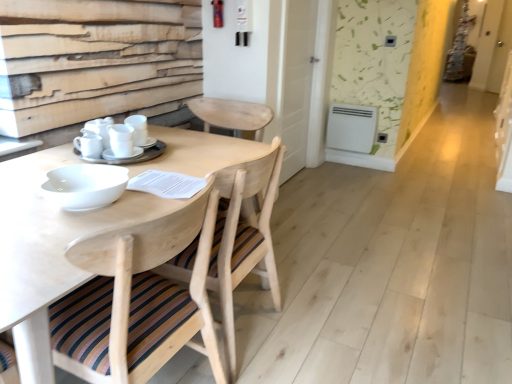
Question: Is the position of white matte cups at center, which appears as the 2th tableware when viewed from the left, more distant than that of natural wood chair at center, which is the second chair from front to back?

Choices:
 (A) no
 (B) yes

Answer: (B)

Question: Considering the relative sizes of white matte cups at center, placed as the second tableware when sorted from right to left, and natural wood chair at center, which is the first chair from back to front, in the image provided, is white matte cups at center, placed as the second tableware when sorted from right to left, thinner than natural wood chair at center, which is the first chair from back to front,?

Choices:
 (A) yes
 (B) no

Answer: (A)

Question: Can you confirm if white matte cups at center, which appears as the 2th tableware when viewed from the left, is taller than natural wood chair at center, which is the second chair from front to back?

Choices:
 (A) yes
 (B) no

Answer: (B)

Question: Considering the relative sizes of white matte cups at center, which appears as the 2th tableware when viewed from the left, and natural wood chair at center, which is the second chair from front to back, in the image provided, is white matte cups at center, which appears as the 2th tableware when viewed from the left, smaller than natural wood chair at center, which is the second chair from front to back,?

Choices:
 (A) yes
 (B) no

Answer: (A)

Question: Does white matte cups at center, which appears as the 2th tableware when viewed from the left, have a greater width compared to natural wood chair at center, which is the second chair from front to back?

Choices:
 (A) no
 (B) yes

Answer: (A)

Question: Does point (146, 153) appear closer or farther from the camera than point (212, 150)?

Choices:
 (A) farther
 (B) closer

Answer: (B)

Question: Is white matte cups at center, placed as the second tableware when sorted from right to left, wider or thinner than natural wood round table at center?

Choices:
 (A) thin
 (B) wide

Answer: (A)

Question: Is white matte cups at center, placed as the second tableware when sorted from right to left, taller or shorter than natural wood round table at center?

Choices:
 (A) tall
 (B) short

Answer: (B)

Question: From a real-world perspective, relative to natural wood round table at center, is white matte cups at center, which appears as the 2th tableware when viewed from the left, vertically above or below?

Choices:
 (A) below
 (B) above

Answer: (B)

Question: From the image's perspective, relative to white glossy screen door at upper right, is white glossy cup at center, placed as the 1th tableware when sorted from left to right, above or below?

Choices:
 (A) above
 (B) below

Answer: (B)

Question: Based on their sizes in the image, would you say white glossy cup at center, placed as the 1th tableware when sorted from left to right, is bigger or smaller than white glossy screen door at upper right?

Choices:
 (A) small
 (B) big

Answer: (A)

Question: From a real-world perspective, relative to white glossy screen door at upper right, is white glossy cup at center, placed as the 1th tableware when sorted from left to right, vertically above or below?

Choices:
 (A) below
 (B) above

Answer: (A)

Question: Would you say white glossy cup at center, placed as the 1th tableware when sorted from left to right, is inside or outside white glossy screen door at upper right?

Choices:
 (A) outside
 (B) inside

Answer: (A)

Question: From the image's perspective, is natural wood chair at center, which is counted as the second chair, starting from the back, above or below white matte cups at center, which appears as the 2th tableware when viewed from the left?

Choices:
 (A) below
 (B) above

Answer: (A)

Question: Considering the positions of natural wood chair at center, the 1th chair from the front, and white matte cups at center, which appears as the 2th tableware when viewed from the left, in the image, is natural wood chair at center, the 1th chair from the front, wider or thinner than white matte cups at center, which appears as the 2th tableware when viewed from the left,?

Choices:
 (A) thin
 (B) wide

Answer: (B)